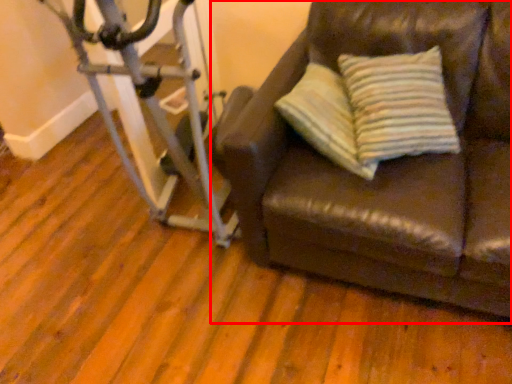
Question: From the image, what is the correct spatial relationship of studio couch (annotated by the red box) in relation to stationary bicycle?

Choices:
 (A) left
 (B) right

Answer: (B)